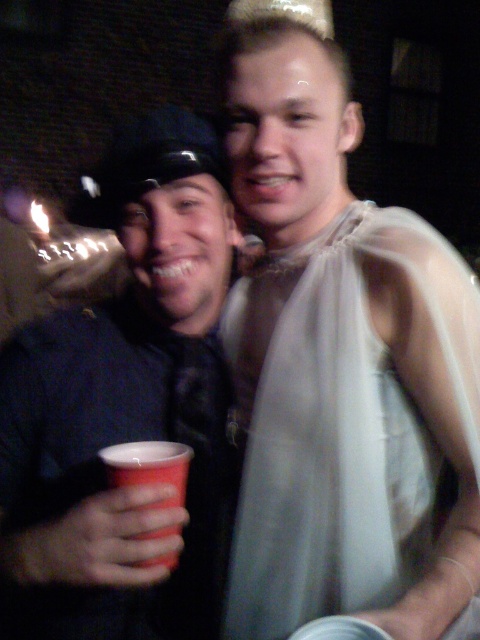
Question: Does matte black cup at left appear over red plastic cup at lower left?

Choices:
 (A) yes
 (B) no

Answer: (A)

Question: Which object is positioned farthest from the sheer white dress at right?

Choices:
 (A) red plastic cup at lower left
 (B) matte black cup at left

Answer: (A)

Question: Does sheer white dress at right come behind red plastic cup at lower left?

Choices:
 (A) no
 (B) yes

Answer: (B)

Question: Is matte black cup at left further to camera compared to red plastic cup at lower left?

Choices:
 (A) yes
 (B) no

Answer: (B)

Question: Which of these objects is positioned farthest from the sheer white dress at right?

Choices:
 (A) red plastic cup at lower left
 (B) matte black cup at left

Answer: (A)

Question: Based on their relative distances, which object is nearer to the red plastic cup at lower left?

Choices:
 (A) sheer white dress at right
 (B) matte black cup at left

Answer: (B)